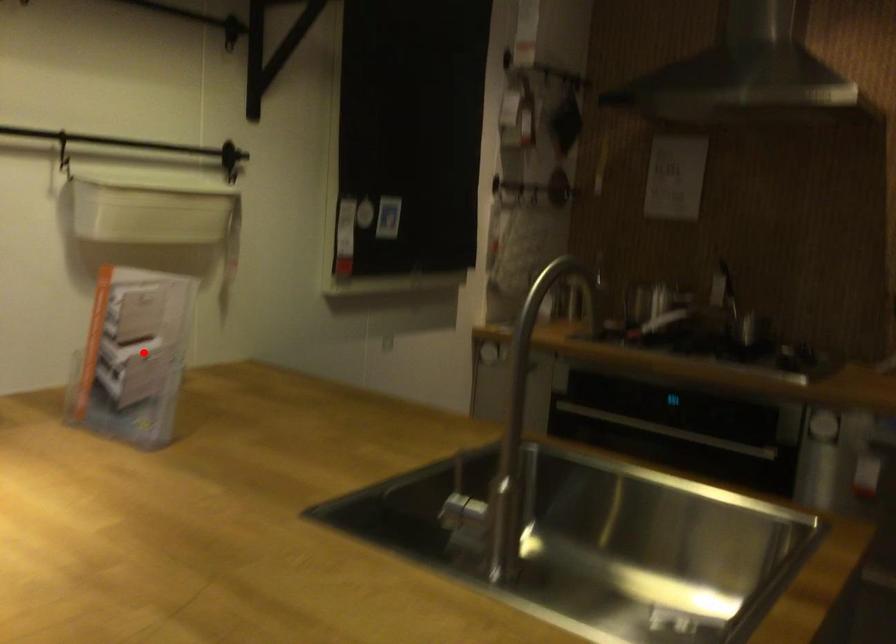
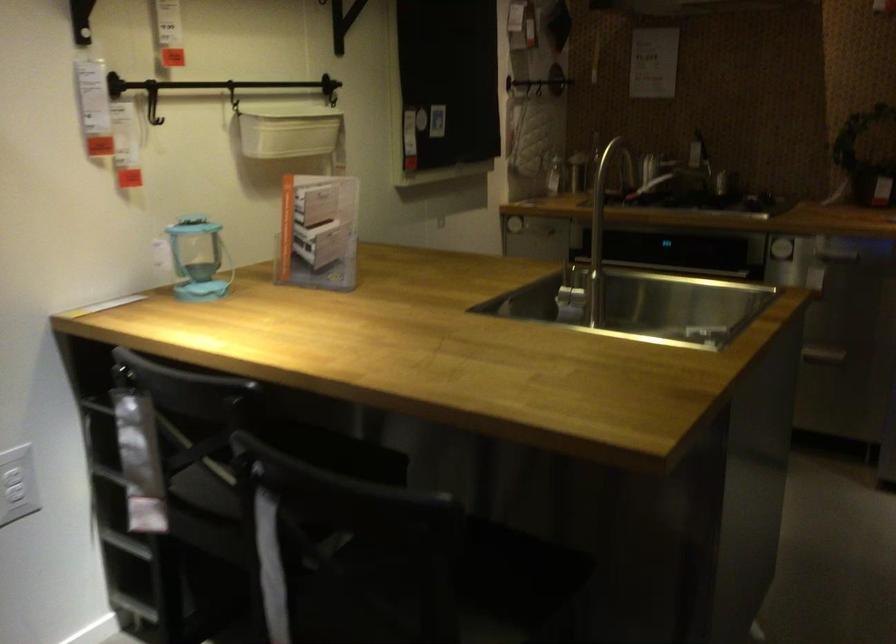
Find the pixel in the second image that matches the highlighted location in the first image.

(317, 232)